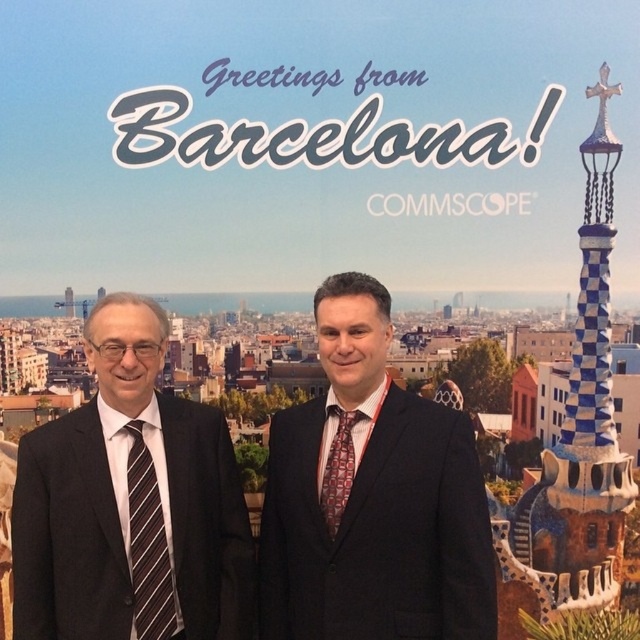
Question: From the image, what is the correct spatial relationship of black suit at center in relation to matte black suit at center?

Choices:
 (A) above
 (B) below

Answer: (B)

Question: Which point is closer to the camera?

Choices:
 (A) (339, 438)
 (B) (38, 534)
 (C) (368, 428)
 (D) (138, 593)

Answer: (D)

Question: Among these objects, which one is farthest from the camera?

Choices:
 (A) matte black suit at center
 (B) patterned silk tie at center
 (C) black suit at center

Answer: (B)

Question: Is black striped tie at left to the right of patterned silk tie at center from the viewer's perspective?

Choices:
 (A) no
 (B) yes

Answer: (A)

Question: Which point is closer to the camera taking this photo?

Choices:
 (A) (353, 444)
 (B) (275, 564)

Answer: (A)

Question: Is striped fabric tie at left bigger than patterned silk tie at center?

Choices:
 (A) yes
 (B) no

Answer: (A)